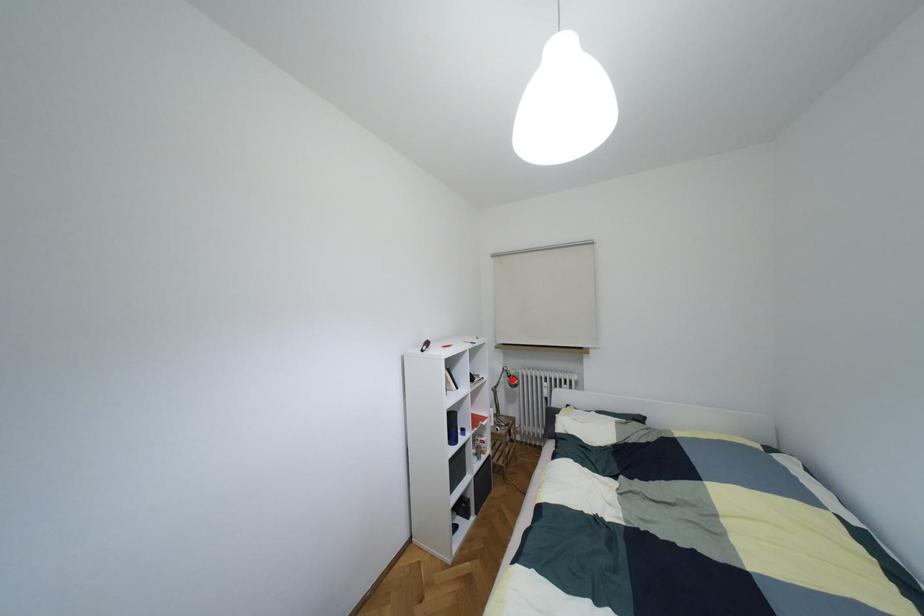
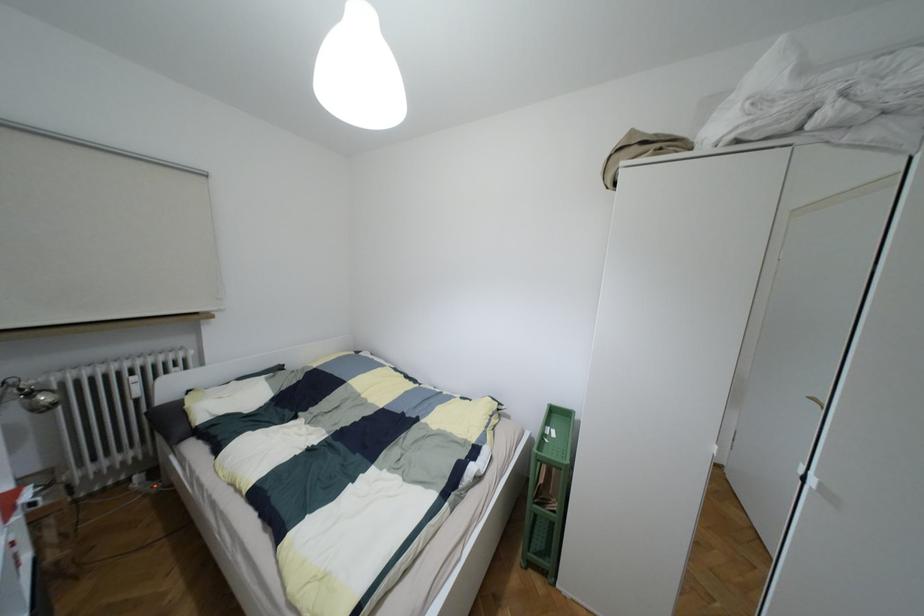
Question: I am providing you with two images of the same scene from different viewpoints. Given a red point in image1, look at the same physical point in image2. Is it:

Choices:
 (A) Closer to the viewpoint
 (B) Farther from the viewpoint

Answer: (B)